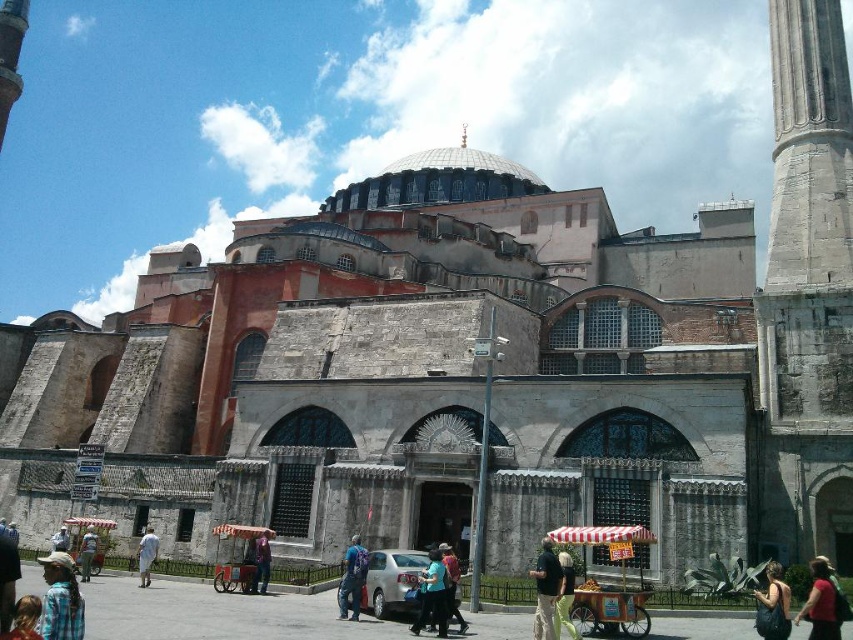
You are a photographer standing in front of the historic mosque. You notice a dark brown leather handbag at lower right and dark blue jeans at center. Which object is positioned higher in the image?

The dark brown leather handbag at lower right is above the dark blue jeans at center, so it is positioned higher in the image.

You are a photographer standing in front of the mosque. You see a dark brown leather handbag at lower right and dark blue jeans at center. Which object is more to the right?

The dark brown leather handbag at lower right is more to the right because it is positioned on the right side of the dark blue jeans at center.